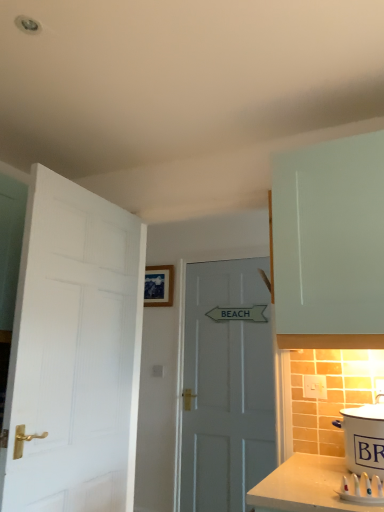
Describe the element at coordinates (314, 387) in the screenshot. This screenshot has height=512, width=384. I see `white plastic electric outlet at lower right` at that location.

I want to click on white ceramic pot at lower right, so click(x=364, y=438).

What do you see at coordinates (362, 489) in the screenshot? I see `white plastic toothbrushes at lower right` at bounding box center [362, 489].

At what (x,y) coordinates should I click in order to perform the action: click on white wooden door at center, which is the second door from left to right. Please return your answer as a coordinate pair (x, y). The image size is (384, 512). Looking at the image, I should click on coord(226,385).

Based on their sizes in the image, would you say white wooden door at center, arranged as the first door when viewed from the right, is bigger or smaller than white matte door at left, positioned as the second door in back-to-front order?

Considering their sizes, white wooden door at center, arranged as the first door when viewed from the right, takes up less space than white matte door at left, positioned as the second door in back-to-front order.

Would you say white wooden door at center, placed as the first door when sorted from back to front, is inside or outside white matte door at left, positioned as the second door in back-to-front order?

white wooden door at center, placed as the first door when sorted from back to front, is outside white matte door at left, positioned as the second door in back-to-front order.

Are white wooden door at center, which is the second door from left to right, and white matte door at left, arranged as the 2th door when viewed from the right, located far from each other?

Absolutely, white wooden door at center, which is the second door from left to right, is distant from white matte door at left, arranged as the 2th door when viewed from the right.

How different are the orientations of white wooden door at center, arranged as the second door when viewed from the front, and white matte door at left, marked as the first door in a front-to-back arrangement, in degrees?

They differ by 91 degrees in their facing directions.

Does white ceramic pot at lower right have a smaller size compared to white plastic electric outlet at lower right?

No, white ceramic pot at lower right is not smaller than white plastic electric outlet at lower right.

Is the depth of white ceramic pot at lower right less than that of white plastic electric outlet at lower right?

Yes, white ceramic pot at lower right is closer to the viewer.

Find the location of `electric outlet above the white ceramic pot at lower right (from the image's perspective)`. electric outlet above the white ceramic pot at lower right (from the image's perspective) is located at coordinates click(x=314, y=387).

Is white ceramic pot at lower right looking in the opposite direction of white plastic electric outlet at lower right?

No.

Could white plastic electric outlet at lower right be considered to be inside white matte door at left, positioned as the second door in back-to-front order?

No, white plastic electric outlet at lower right is not surrounded by white matte door at left, positioned as the second door in back-to-front order.

Considering the positions of objects white matte door at left, the 1th door positioned from the left, and white plastic electric outlet at lower right in the image provided, who is behind, white matte door at left, the 1th door positioned from the left, or white plastic electric outlet at lower right?

white plastic electric outlet at lower right is more distant.

From a real-world perspective, is white matte door at left, marked as the first door in a front-to-back arrangement, under white plastic electric outlet at lower right?

Actually, white matte door at left, marked as the first door in a front-to-back arrangement, is physically above white plastic electric outlet at lower right in the real world.

From the image's perspective, is white matte door at left, marked as the first door in a front-to-back arrangement, on top of white plastic electric outlet at lower right?

Yes, from the image's perspective, white matte door at left, marked as the first door in a front-to-back arrangement, is over white plastic electric outlet at lower right.

Is white wooden door at center, arranged as the first door when viewed from the right, far away from white ceramic pot at lower right?

Indeed, white wooden door at center, arranged as the first door when viewed from the right, is not near white ceramic pot at lower right.

Could you tell me if white wooden door at center, arranged as the second door when viewed from the front, is turned towards white ceramic pot at lower right?

No, white wooden door at center, arranged as the second door when viewed from the front, is not facing towards white ceramic pot at lower right.

Consider the image. Between white wooden door at center, placed as the first door when sorted from back to front, and white ceramic pot at lower right, which one has larger width?

white ceramic pot at lower right.

How many degrees apart are the facing directions of white wooden door at center, arranged as the second door when viewed from the front, and white ceramic pot at lower right?

0.507 degrees.

Between white ceramic pot at lower right and white plastic toothbrushes at lower right, which one has less height?

Standing shorter between the two is white plastic toothbrushes at lower right.

From the image's perspective, would you say white ceramic pot at lower right is positioned over white plastic toothbrushes at lower right?

Yes, from the image's perspective, white ceramic pot at lower right is on top of white plastic toothbrushes at lower right.

Relative to white plastic toothbrushes at lower right, is white ceramic pot at lower right in front or behind?

Clearly, white ceramic pot at lower right is behind white plastic toothbrushes at lower right.

Is white plastic toothbrushes at lower right located within white ceramic pot at lower right?

No, white plastic toothbrushes at lower right is not a part of white ceramic pot at lower right.

Which of these two, white matte door at left, the 1th door positioned from the left, or white ceramic pot at lower right, is bigger?

white matte door at left, the 1th door positioned from the left.

Who is taller, white matte door at left, positioned as the second door in back-to-front order, or white ceramic pot at lower right?

Standing taller between the two is white matte door at left, positioned as the second door in back-to-front order.

From a real-world perspective, is white matte door at left, arranged as the 2th door when viewed from the right, above or below white ceramic pot at lower right?

From a real-world perspective, white matte door at left, arranged as the 2th door when viewed from the right, is physically above white ceramic pot at lower right.

Can you tell me how much white matte door at left, the 1th door positioned from the left, and white ceramic pot at lower right differ in facing direction?

The facing directions of white matte door at left, the 1th door positioned from the left, and white ceramic pot at lower right are 91.5 degrees apart.

Is white wooden door at center, arranged as the first door when viewed from the right, thinner than white plastic electric outlet at lower right?

In fact, white wooden door at center, arranged as the first door when viewed from the right, might be wider than white plastic electric outlet at lower right.

This screenshot has width=384, height=512. What are the coordinates of `electric outlet above the white wooden door at center, which is the second door from left to right (from the image's perspective)` in the screenshot? It's located at (314, 387).

Are white wooden door at center, arranged as the second door when viewed from the front, and white plastic electric outlet at lower right located far from each other?

white wooden door at center, arranged as the second door when viewed from the front, is far away from white plastic electric outlet at lower right.

Which of these two, white wooden door at center, which is the second door from left to right, or white plastic electric outlet at lower right, is smaller?

Smaller between the two is white plastic electric outlet at lower right.

At what (x,y) coordinates should I click in order to perform the action: click on door behind the white matte door at left, arranged as the 2th door when viewed from the right. Please return your answer as a coordinate pair (x, y). The height and width of the screenshot is (512, 384). Looking at the image, I should click on (226, 385).

You are a GUI agent. You are given a task and a screenshot of the screen. Output one action in this format:
    pyautogui.click(x=<x>, y=<y>)
    Task: Click on the electric outlet above the white ceramic pot at lower right (from a real-world perspective)
    The width and height of the screenshot is (384, 512).
    Given the screenshot: What is the action you would take?
    pyautogui.click(x=314, y=387)

When comparing their distances from white plastic toothbrushes at lower right, does white matte door at left, arranged as the 2th door when viewed from the right, or white wooden door at center, arranged as the first door when viewed from the right, seem further?

Based on the image, white wooden door at center, arranged as the first door when viewed from the right, appears to be further to white plastic toothbrushes at lower right.

Looking at the image, which one is located closer to white plastic toothbrushes at lower right, white matte door at left, positioned as the second door in back-to-front order, or white ceramic pot at lower right?

white ceramic pot at lower right lies closer to white plastic toothbrushes at lower right than the other object.

Which object lies nearer to the anchor point white plastic electric outlet at lower right, white ceramic pot at lower right or white plastic toothbrushes at lower right?

white ceramic pot at lower right is closer to white plastic electric outlet at lower right.

Looking at the image, which one is located closer to white wooden door at center, arranged as the second door when viewed from the front, white plastic toothbrushes at lower right or white ceramic pot at lower right?

white ceramic pot at lower right lies closer to white wooden door at center, arranged as the second door when viewed from the front, than the other object.

Estimate the real-world distances between objects in this image. Which object is closer to white plastic electric outlet at lower right, white plastic toothbrushes at lower right or white wooden door at center, arranged as the first door when viewed from the right?

Based on the image, white plastic toothbrushes at lower right appears to be nearer to white plastic electric outlet at lower right.

Estimate the real-world distances between objects in this image. Which object is further from white ceramic pot at lower right, white plastic toothbrushes at lower right or white matte door at left, arranged as the 2th door when viewed from the right?

The object further to white ceramic pot at lower right is white matte door at left, arranged as the 2th door when viewed from the right.

From the image, which object appears to be farther from white plastic electric outlet at lower right, white wooden door at center, arranged as the first door when viewed from the right, or white plastic toothbrushes at lower right?

white wooden door at center, arranged as the first door when viewed from the right.

Estimate the real-world distances between objects in this image. Which object is closer to white plastic toothbrushes at lower right, white ceramic pot at lower right or white plastic electric outlet at lower right?

white ceramic pot at lower right is positioned closer to the anchor white plastic toothbrushes at lower right.

Locate an element on the screen. electric outlet between white matte door at left, marked as the first door in a front-to-back arrangement, and white ceramic pot at lower right, in the horizontal direction is located at coordinates (314, 387).

Image resolution: width=384 pixels, height=512 pixels. What are the coordinates of `door between white ceramic pot at lower right and white wooden door at center, placed as the first door when sorted from back to front, from front to back` in the screenshot? It's located at (74, 353).

Where is `cooker between white plastic toothbrushes at lower right and white wooden door at center, arranged as the second door when viewed from the front, in the front-back direction`? The height and width of the screenshot is (512, 384). cooker between white plastic toothbrushes at lower right and white wooden door at center, arranged as the second door when viewed from the front, in the front-back direction is located at coordinates (364, 438).

Find the location of a particular element. electric outlet between white ceramic pot at lower right and white wooden door at center, placed as the first door when sorted from back to front, along the z-axis is located at coordinates (314, 387).